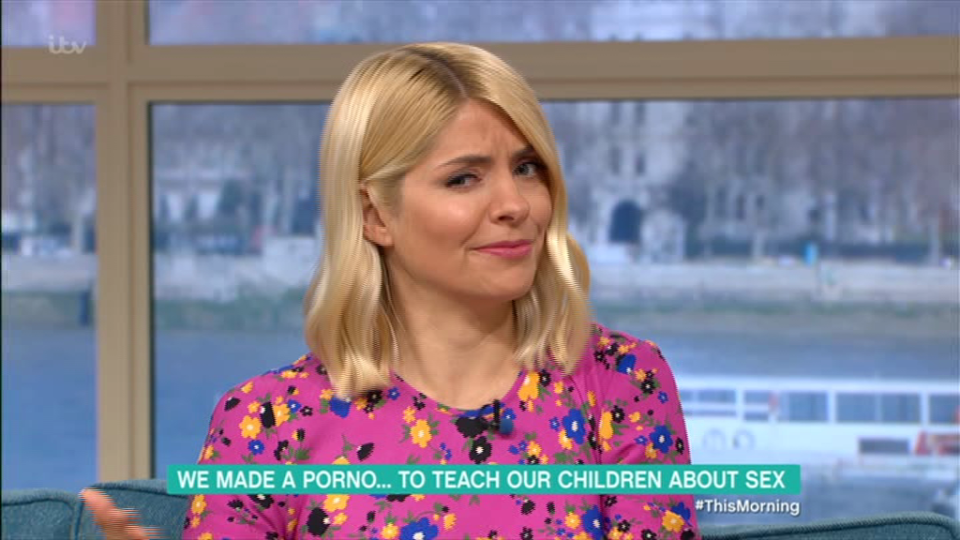
Identify the location of window. (708, 154), (29, 239), (32, 22), (358, 17).